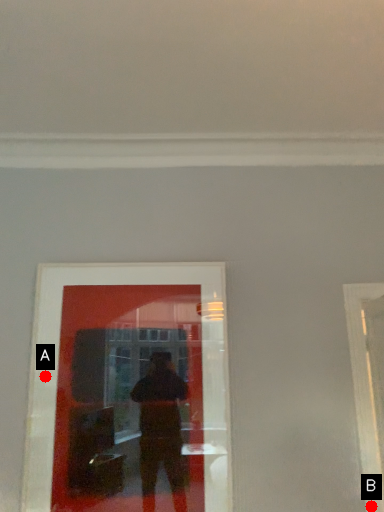
Question: Two points are circled on the image, labeled by A and B beside each circle. Which point is farther from the camera taking this photo?

Choices:
 (A) A is further
 (B) B is further

Answer: (A)